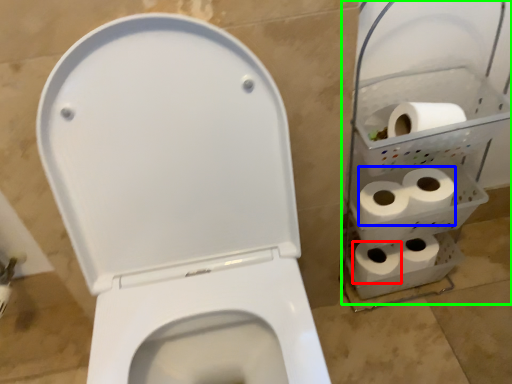
Question: Which object is the closest to the toilet paper (highlighted by a red box)? Choose among these: toilet paper (highlighted by a blue box) or shelf (highlighted by a green box).

Choices:
 (A) toilet paper
 (B) shelf

Answer: (A)